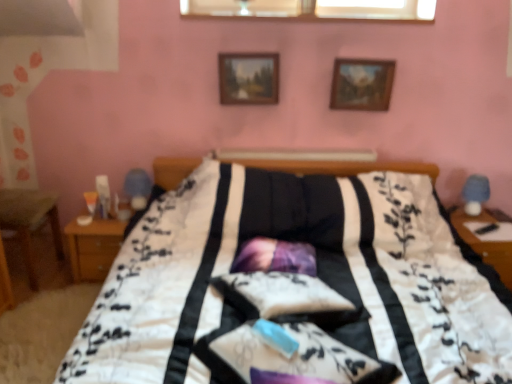
I want to click on blank space situated above wooden nightstand at left (from a real-world perspective), so click(x=104, y=221).